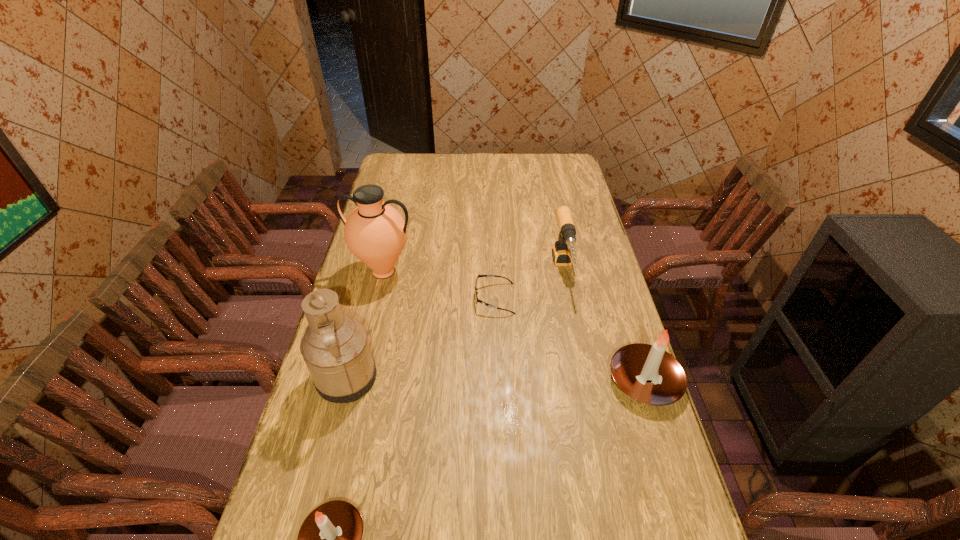
What are the coordinates of `vacant area at the right edge of the desktop` in the screenshot? It's located at (604, 375).

In the image, there is a desktop. Identify the location of vacant area at the far left corner. This screenshot has height=540, width=960. (417, 154).

Identify the location of vacant space at the near right corner of the desktop. This screenshot has height=540, width=960. (665, 505).

Find the location of a particular element. blank region between the shortest object and the farther candle is located at coordinates (570, 340).

Locate an element on the screen. Image resolution: width=960 pixels, height=540 pixels. vacant space that is in between the sunglasses and the farther pitcher is located at coordinates (439, 285).

The width and height of the screenshot is (960, 540). Identify the location of vacant area between the nearer pitcher and the fourth object from left to right. (420, 339).

This screenshot has width=960, height=540. In order to click on free point between the fourth object from left to right and the nearer pitcher in this screenshot , I will do `click(420, 339)`.

Where is `free area in between the nearer pitcher and the taller candle`? The width and height of the screenshot is (960, 540). free area in between the nearer pitcher and the taller candle is located at coordinates (495, 380).

This screenshot has width=960, height=540. Identify the location of free spot between the farther candle and the shortest object. (570, 340).

You are a GUI agent. You are given a task and a screenshot of the screen. Output one action in this format:
    pyautogui.click(x=<x>, y=<y>)
    Task: Click on the free area in between the nearer pitcher and the farther candle
    This screenshot has width=960, height=540.
    Given the screenshot: What is the action you would take?
    pyautogui.click(x=495, y=380)